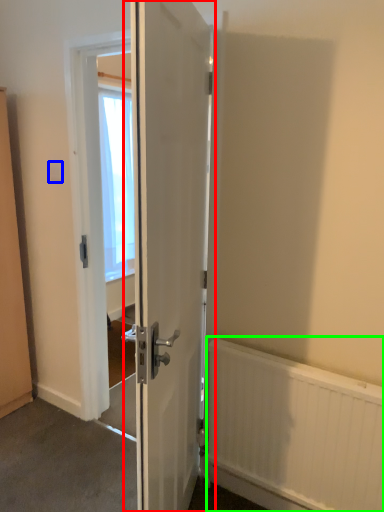
Question: Estimate the real-world distances between objects in this image. Which object is closer to door (highlighted by a red box), electric outlet (highlighted by a blue box) or radiator (highlighted by a green box)?

Choices:
 (A) electric outlet
 (B) radiator

Answer: (B)